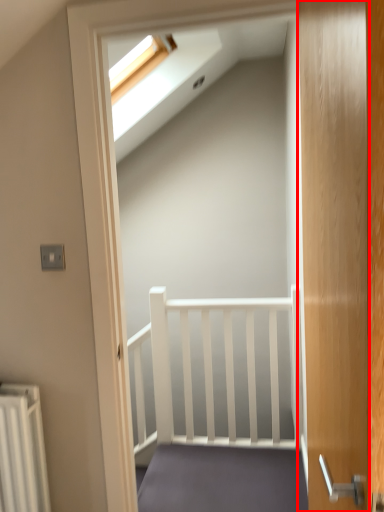
Question: From the image's perspective, what is the correct spatial positioning of door (annotated by the red box) in reference to stairs?

Choices:
 (A) below
 (B) above

Answer: (B)